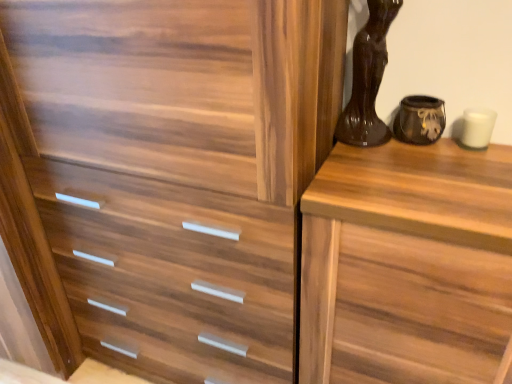
What are the coordinates of `free space in front of shiny brown vase at upper right, the first vase from the left` in the screenshot? It's located at (390, 173).